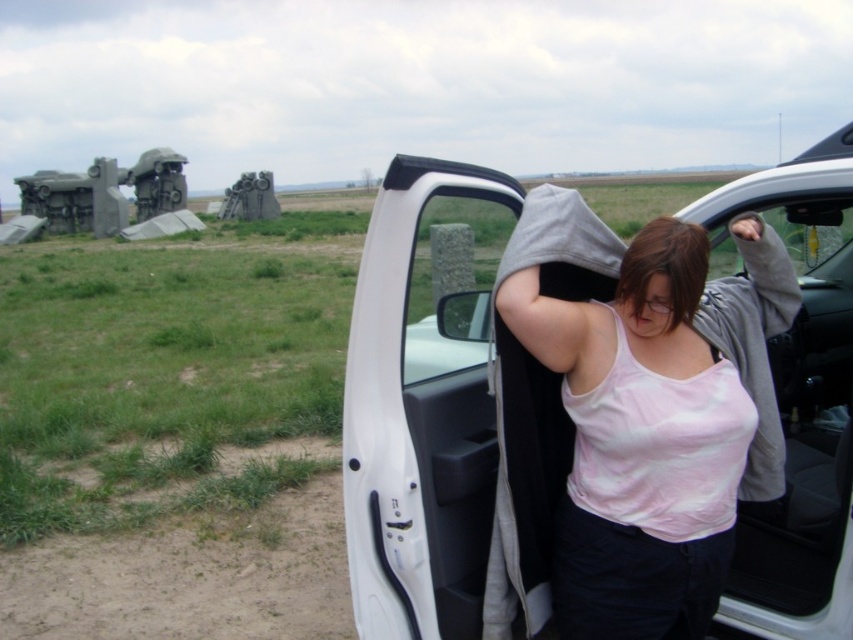
You are a photographer taking a picture of the scene. You notice the white matte car door at center and the pink cotton tank top at center. Which object should you focus on first if you want to capture both in sharp focus, considering their positions?

The white matte car door at center is above the pink cotton tank top at center, so focusing on the car door first would ensure both are in focus as they are aligned vertically.

You are standing at the entrance of the field and want to reach the white matte car door at center. Which direction should you head towards based on its position?

The white matte car door at center is located at point coordinates, so you should head towards the center of the field to reach it.